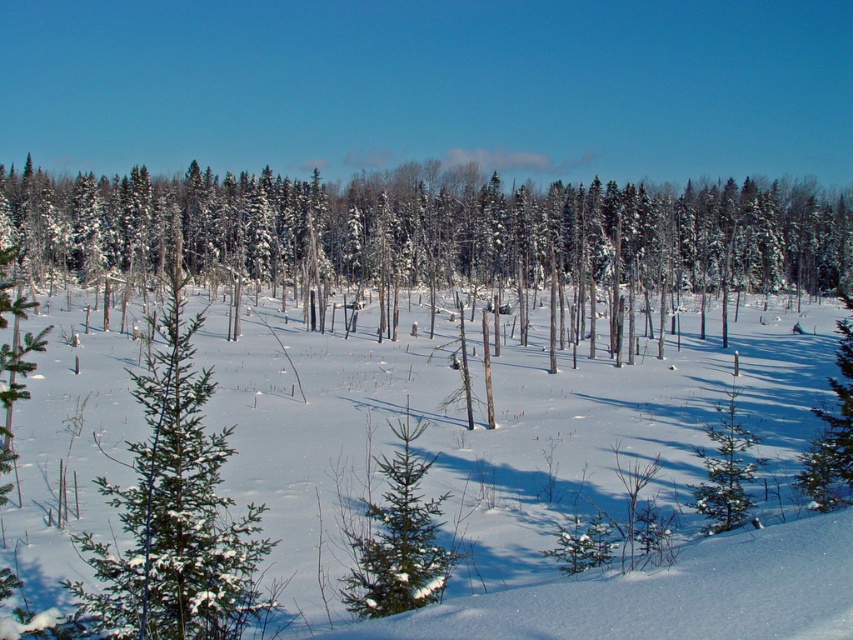
Consider the image. You are a photographer setting up a tripod in the winter landscape scene. You want to place your camera so that both the point at coordinates point [561,435] and the point at coordinates point [379,586] are in the frame. Which point should you focus on first to ensure both are in focus?

You should focus on point [379,586] first because it is closer to the camera than point [561,435]. By focusing on the closer point, the depth of field will likely include the farther point as well.

You are an outdoor photographer planning to capture the winter landscape. You notice the white fluffy snow at center and the green textured pine at center. Which object would you focus on if you want to highlight something larger in the scene?

The white fluffy snow at center is bigger than the green textured pine at center, so focusing on the white fluffy snow at center would highlight the larger object in the scene.

You are a hiker trying to navigate through the winter landscape. You see the white fluffy snow at center and the green textured pine at center. Which object is located to the left of the other?

The white fluffy snow at center is positioned on the left side of green textured pine at center.